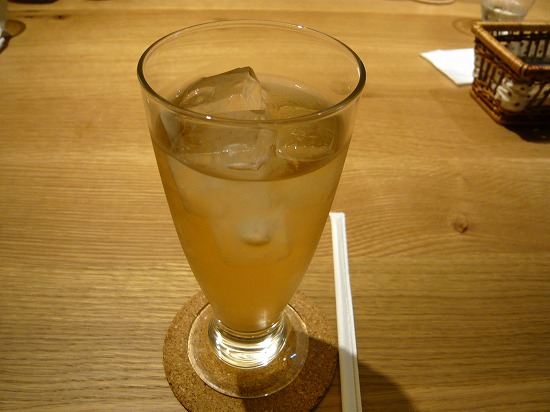
At what (x,y) coordinates should I click in order to perform the action: click on napkin. Please return your answer as a coordinate pair (x, y). The width and height of the screenshot is (550, 412). Looking at the image, I should click on (448, 65).